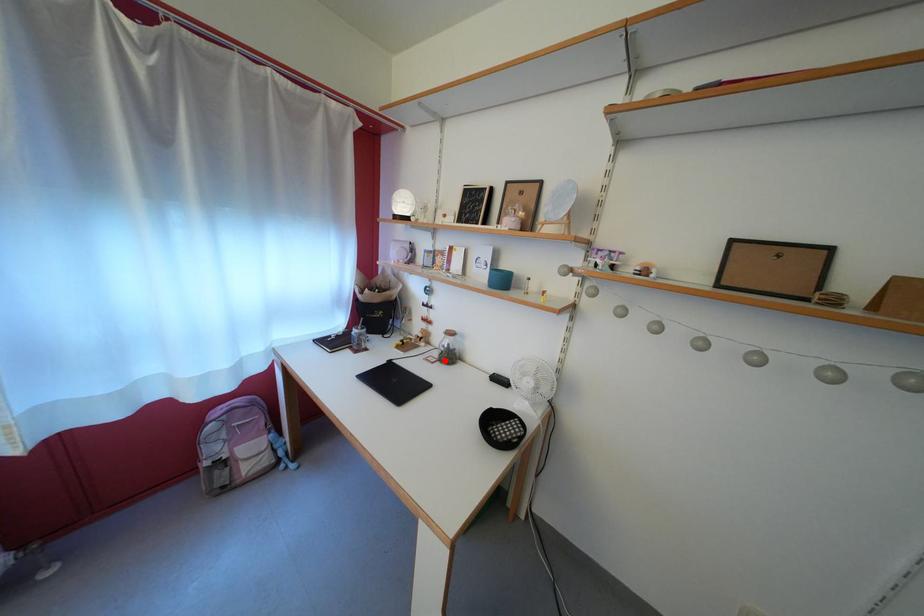
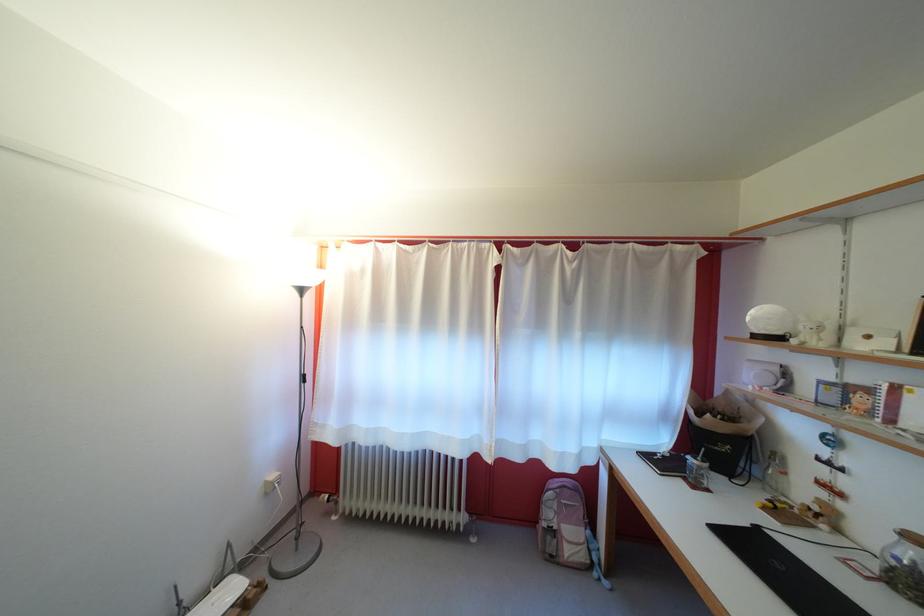
Find the pixel in the second image that matches the highlighted location in the first image.

(881, 570)